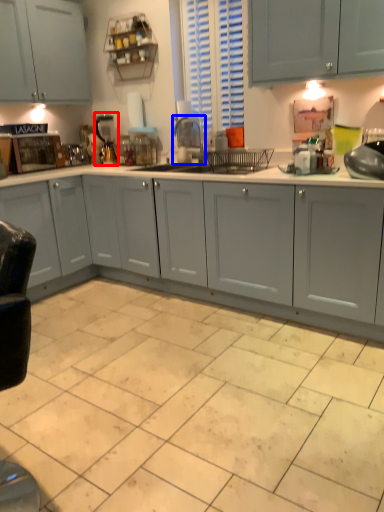
Question: Which point is closer to the camera, appliance (highlighted by a red box) or appliance (highlighted by a blue box)?

Choices:
 (A) appliance
 (B) appliance

Answer: (B)